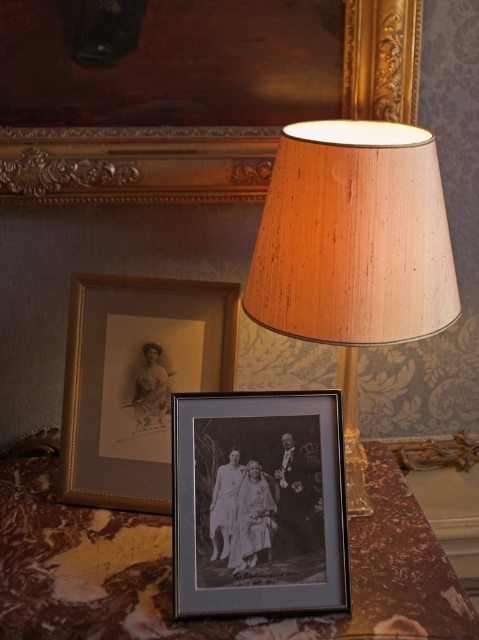
Question: Which of the following is the farthest from the observer?

Choices:
 (A) black matte photo frame at center
 (B) marble table at center
 (C) gold-framed portrait at upper left

Answer: (C)

Question: Is the position of wooden lampshade at upper center more distant than that of matte gold picture frame at upper center?

Choices:
 (A) yes
 (B) no

Answer: (B)

Question: Considering the real-world distances, which object is farthest from the matte gold picture frame at upper center?

Choices:
 (A) black matte photo frame at center
 (B) marble table at center
 (C) wooden lampshade at upper center
 (D) gold-framed portrait at upper left

Answer: (B)

Question: Does marble table at center have a greater width compared to wooden lampshade at upper center?

Choices:
 (A) no
 (B) yes

Answer: (B)

Question: Which of the following is the farthest from the observer?

Choices:
 (A) (443, 570)
 (B) (226, 380)

Answer: (B)

Question: Does wooden lampshade at upper center have a smaller size compared to gold-framed portrait at upper left?

Choices:
 (A) yes
 (B) no

Answer: (B)